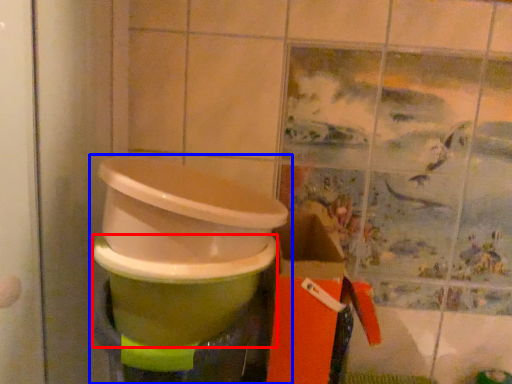
Question: Which point is closer to the camera, toilet bowl (highlighted by a red box) or waste container (highlighted by a blue box)?

Choices:
 (A) toilet bowl
 (B) waste container

Answer: (B)